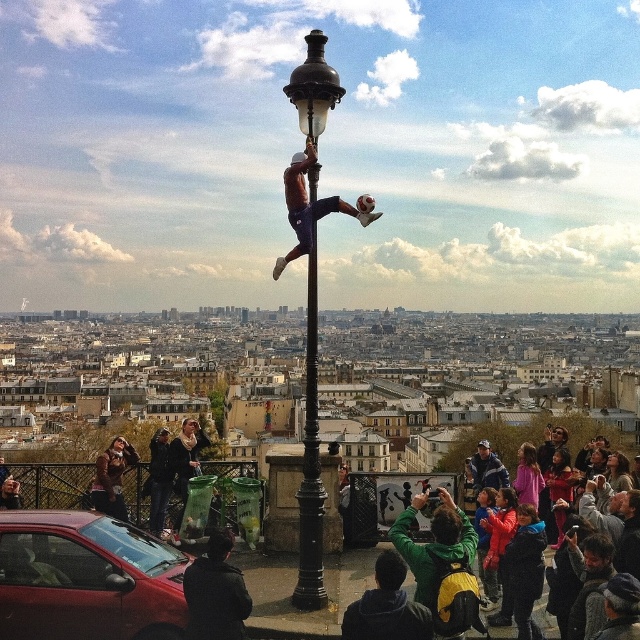
Question: Does black polished metal street light at center appear on the right side of blue denim jacket at center?

Choices:
 (A) no
 (B) yes

Answer: (A)

Question: Which point is closer to the camera?

Choices:
 (A) (497, 474)
 (B) (550, 460)

Answer: (A)

Question: Is black polished metal street light at center to the left of smooth brown leather jacket at lower right from the viewer's perspective?

Choices:
 (A) no
 (B) yes

Answer: (B)

Question: Among these objects, which one is nearest to the camera?

Choices:
 (A) blue denim jacket at center
 (B) smooth brown leather jacket at lower right
 (C) black polished metal street light at center

Answer: (C)

Question: Does black polished metal street light at center have a greater width compared to smooth brown leather jacket at lower right?

Choices:
 (A) yes
 (B) no

Answer: (B)

Question: Which point is closer to the camera taking this photo?

Choices:
 (A) pyautogui.click(x=308, y=83)
 (B) pyautogui.click(x=540, y=448)

Answer: (A)